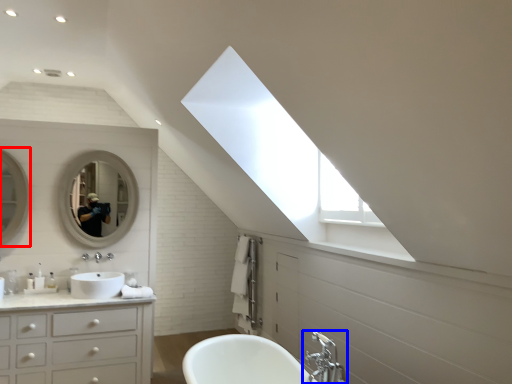
Question: Which of the following is the farthest to the observer, mirror (highlighted by a red box) or tap (highlighted by a blue box)?

Choices:
 (A) mirror
 (B) tap

Answer: (A)